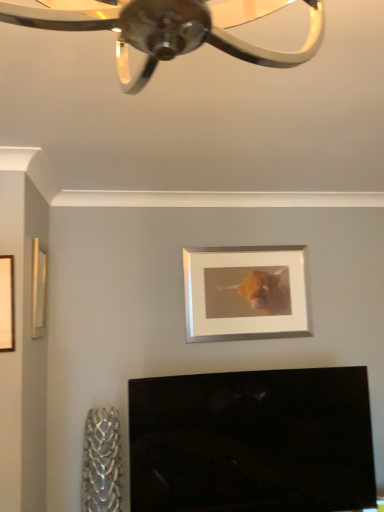
Question: Which direction should I rotate to look at white matte picture frame at upper center, acting as the 3th picture frame starting from the front?

Choices:
 (A) right
 (B) left

Answer: (A)

Question: From a real-world perspective, is wooden frame at left, marked as the 1th picture frame in a front-to-back arrangement, located beneath wooden frame at left, the second picture frame viewed from the back?

Choices:
 (A) yes
 (B) no

Answer: (A)

Question: From the image's perspective, is wooden frame at left, placed as the 3th picture frame when sorted from back to front, beneath wooden frame at left, which is the second picture frame from right to left?

Choices:
 (A) no
 (B) yes

Answer: (B)

Question: Does wooden frame at left, marked as the 1th picture frame in a front-to-back arrangement, have a larger size compared to wooden frame at left, which is the second picture frame from right to left?

Choices:
 (A) yes
 (B) no

Answer: (B)

Question: Is wooden frame at left, the second picture frame viewed from the back, at the back of wooden frame at left, which is counted as the 1th picture frame, starting from the left?

Choices:
 (A) no
 (B) yes

Answer: (B)

Question: Can you confirm if wooden frame at left, marked as the 1th picture frame in a front-to-back arrangement, is shorter than wooden frame at left, which is the second picture frame from right to left?

Choices:
 (A) no
 (B) yes

Answer: (B)

Question: Does wooden frame at left, arranged as the 3th picture frame when viewed from the right, have a greater height compared to wooden frame at left, the 2th picture frame positioned from the front?

Choices:
 (A) yes
 (B) no

Answer: (B)

Question: From the image's perspective, is white matte picture frame at upper center, which is the 1th picture frame from back to front, below wooden frame at left, which is counted as the 1th picture frame, starting from the left?

Choices:
 (A) no
 (B) yes

Answer: (B)

Question: From the image's perspective, is white matte picture frame at upper center, acting as the 3th picture frame starting from the front, on wooden frame at left, which is counted as the 1th picture frame, starting from the left?

Choices:
 (A) yes
 (B) no

Answer: (B)

Question: Considering the relative sizes of white matte picture frame at upper center, acting as the 3th picture frame starting from the front, and wooden frame at left, which is counted as the 1th picture frame, starting from the left, in the image provided, is white matte picture frame at upper center, acting as the 3th picture frame starting from the front, bigger than wooden frame at left, which is counted as the 1th picture frame, starting from the left,?

Choices:
 (A) no
 (B) yes

Answer: (B)

Question: Is wooden frame at left, arranged as the 3th picture frame when viewed from the right, a part of white matte picture frame at upper center, acting as the 3th picture frame starting from the front?

Choices:
 (A) no
 (B) yes

Answer: (A)

Question: Considering the relative sizes of white matte picture frame at upper center, acting as the 3th picture frame starting from the front, and wooden frame at left, which is counted as the 1th picture frame, starting from the left, in the image provided, is white matte picture frame at upper center, acting as the 3th picture frame starting from the front, smaller than wooden frame at left, which is counted as the 1th picture frame, starting from the left,?

Choices:
 (A) no
 (B) yes

Answer: (A)

Question: Is white matte picture frame at upper center, which is the 1th picture frame from back to front, not near wooden frame at left, which is counted as the 1th picture frame, starting from the left?

Choices:
 (A) no
 (B) yes

Answer: (B)

Question: Is white matte picture frame at upper center, placed as the 3th picture frame when sorted from left to right, to the left of wooden frame at left, the second picture frame viewed from the back, from the viewer's perspective?

Choices:
 (A) no
 (B) yes

Answer: (A)